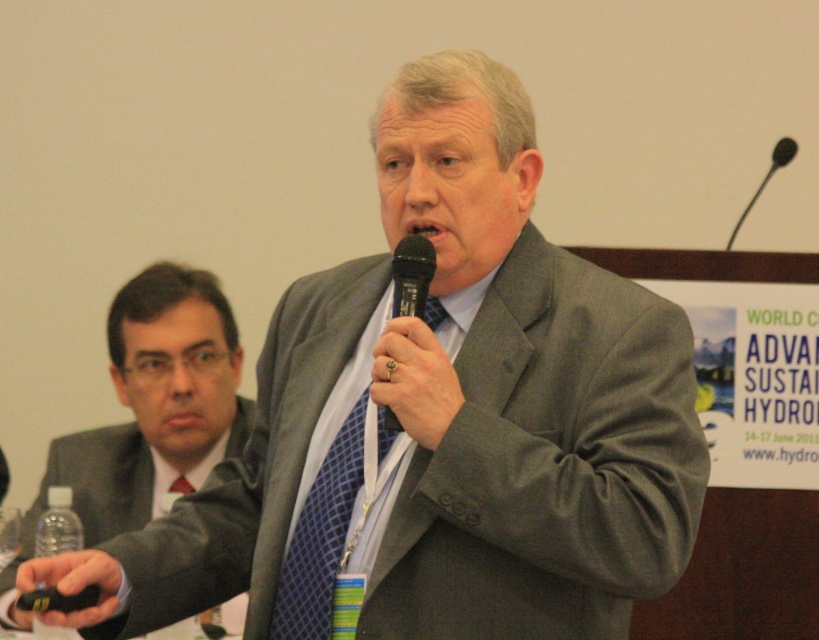
Between blue checkered tie at center and black plastic remote at lower left, which one has more height?

blue checkered tie at center

Does point (281, 618) come farther from viewer compared to point (78, 614)?

Yes, point (281, 618) is behind point (78, 614).

At what (x,y) coordinates should I click in order to perform the action: click on blue checkered tie at center. Please return your answer as a coordinate pair (x, y). This screenshot has width=819, height=640. Looking at the image, I should click on (320, 536).

Is point (378, 403) farther from viewer compared to point (419, 275)?

No, it is not.

What do you see at coordinates (415, 380) in the screenshot? I see `gold ring at center` at bounding box center [415, 380].

Is point (426, 326) in front of point (401, 285)?

That is True.

Identify the location of gold ring at center. (415, 380).

Image resolution: width=819 pixels, height=640 pixels. What do you see at coordinates (410, 275) in the screenshot? I see `black plastic microphone at center` at bounding box center [410, 275].

Image resolution: width=819 pixels, height=640 pixels. What do you see at coordinates (410, 275) in the screenshot?
I see `black plastic microphone at center` at bounding box center [410, 275].

You are a GUI agent. You are given a task and a screenshot of the screen. Output one action in this format:
    pyautogui.click(x=<x>, y=<y>)
    Task: Click on the black plastic microphone at center
    This screenshot has width=819, height=640.
    Given the screenshot: What is the action you would take?
    pyautogui.click(x=410, y=275)